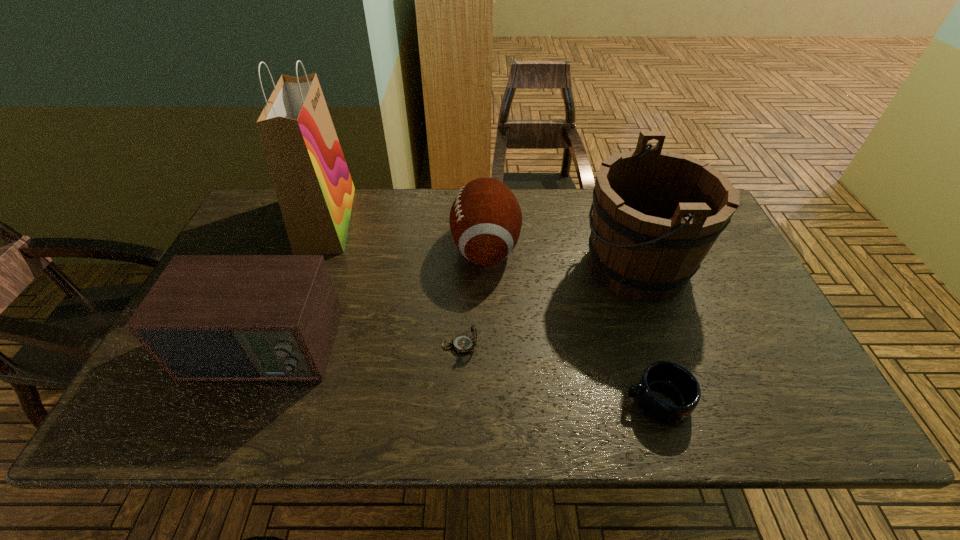
Find the location of a particular element. This screenshot has width=960, height=540. free space between the mug and the radio receiver is located at coordinates (460, 375).

The image size is (960, 540). I want to click on unoccupied position between the football and the mug, so click(x=571, y=324).

I want to click on object that is the fourth closest to the football, so (315, 191).

Locate which object is the second closest to the mug. Please provide its 2D coordinates. Your answer should be formatted as a tuple, i.e. [(x, y)], where the tuple contains the x and y coordinates of a point satisfying the conditions above.

[(463, 343)]

Locate an element on the screen. Image resolution: width=960 pixels, height=540 pixels. vacant space that satisfies the following two spatial constraints: 1. on the face of the compass; 2. on the front-facing side of the radio receiver is located at coordinates (460, 348).

Locate an element on the screen. This screenshot has width=960, height=540. vacant region that satisfies the following two spatial constraints: 1. on the side of the fifth shortest object with the handle for carrying; 2. on the front-facing side of the radio receiver is located at coordinates (666, 348).